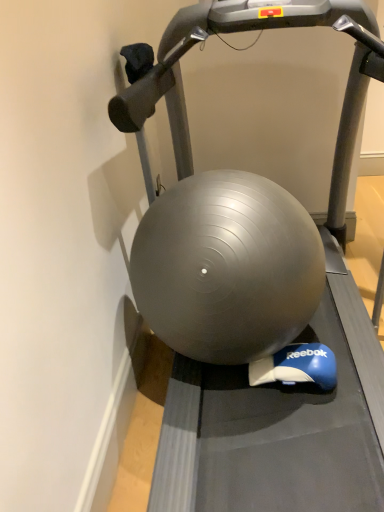
Where is `matte gray ball at center`? This screenshot has width=384, height=512. matte gray ball at center is located at coordinates (227, 267).

What do you see at coordinates (227, 267) in the screenshot? The width and height of the screenshot is (384, 512). I see `matte gray ball at center` at bounding box center [227, 267].

This screenshot has height=512, width=384. What do you see at coordinates (249, 303) in the screenshot?
I see `silver metallic treadmill at center` at bounding box center [249, 303].

At what (x,y) coordinates should I click in order to perform the action: click on silver metallic treadmill at center. Please return your answer as a coordinate pair (x, y). The height and width of the screenshot is (512, 384). Looking at the image, I should click on (249, 303).

Where is `matte gray ball at center`? The image size is (384, 512). matte gray ball at center is located at coordinates (227, 267).

Based on the photo, considering the relative positions of silver metallic treadmill at center and matte gray ball at center in the image provided, is silver metallic treadmill at center to the left of matte gray ball at center from the viewer's perspective?

No, silver metallic treadmill at center is not to the left of matte gray ball at center.

Between silver metallic treadmill at center and matte gray ball at center, which one is positioned in front?

silver metallic treadmill at center.

Is point (248, 360) positioned after point (303, 252)?

Yes, it is.

From the image's perspective, which one is positioned higher, silver metallic treadmill at center or matte gray ball at center?

silver metallic treadmill at center.

From a real-world perspective, who is located lower, silver metallic treadmill at center or matte gray ball at center?

matte gray ball at center is physically lower.

In the scene shown: Considering the sizes of silver metallic treadmill at center and matte gray ball at center in the image, is silver metallic treadmill at center wider or thinner than matte gray ball at center?

In the image, silver metallic treadmill at center appears to be wider than matte gray ball at center.

Considering the sizes of objects silver metallic treadmill at center and matte gray ball at center in the image provided, who is taller, silver metallic treadmill at center or matte gray ball at center?

silver metallic treadmill at center.

Is silver metallic treadmill at center smaller than matte gray ball at center?

Incorrect, silver metallic treadmill at center is not smaller in size than matte gray ball at center.

Is matte gray ball at center located within silver metallic treadmill at center?

Yes, matte gray ball at center is inside silver metallic treadmill at center.

Is silver metallic treadmill at center not close to matte gray ball at center?

No, silver metallic treadmill at center is not far from matte gray ball at center.

In the scene shown: Is silver metallic treadmill at center looking in the opposite direction of matte gray ball at center?

Yes, matte gray ball at center is at the back of silver metallic treadmill at center.

Consider the image. How many degrees apart are the facing directions of silver metallic treadmill at center and matte gray ball at center?

The angular difference between silver metallic treadmill at center and matte gray ball at center is 1.43 degrees.

You are a GUI agent. You are given a task and a screenshot of the screen. Output one action in this format:
    pyautogui.click(x=<x>, y=<y>)
    Task: Click on the treadmill in front of the matte gray ball at center
    The height and width of the screenshot is (512, 384).
    Given the screenshot: What is the action you would take?
    pyautogui.click(x=249, y=303)

Which is more to the left, matte gray ball at center or silver metallic treadmill at center?

From the viewer's perspective, matte gray ball at center appears more on the left side.

In the scene shown: In the image, is matte gray ball at center positioned in front of or behind silver metallic treadmill at center?

In the image, matte gray ball at center appears behind silver metallic treadmill at center.

Considering the points (255, 313) and (190, 184), which point is in front, point (255, 313) or point (190, 184)?

The point (255, 313) is closer to the camera.

From the image's perspective, is matte gray ball at center above or below silver metallic treadmill at center?

matte gray ball at center is below silver metallic treadmill at center.

From a real-world perspective, is matte gray ball at center on silver metallic treadmill at center?

No, from a real-world perspective, matte gray ball at center is not on top of silver metallic treadmill at center.

Considering the relative sizes of matte gray ball at center and silver metallic treadmill at center in the image provided, is matte gray ball at center wider than silver metallic treadmill at center?

Incorrect, the width of matte gray ball at center does not surpass that of silver metallic treadmill at center.

Does matte gray ball at center have a lesser height compared to silver metallic treadmill at center?

Indeed, matte gray ball at center has a lesser height compared to silver metallic treadmill at center.

Who is bigger, matte gray ball at center or silver metallic treadmill at center?

With larger size is silver metallic treadmill at center.

Is silver metallic treadmill at center located within matte gray ball at center?

No, silver metallic treadmill at center is not inside matte gray ball at center.

Is matte gray ball at center with silver metallic treadmill at center?

Yes.

Is matte gray ball at center aimed at silver metallic treadmill at center?

Yes, matte gray ball at center is oriented towards silver metallic treadmill at center.

Can you tell me how much matte gray ball at center and silver metallic treadmill at center differ in facing direction?

The facing directions of matte gray ball at center and silver metallic treadmill at center are 1.43 degrees apart.

You are a GUI agent. You are given a task and a screenshot of the screen. Output one action in this format:
    pyautogui.click(x=<x>, y=<y>)
    Task: Click on the ball lying behind the silver metallic treadmill at center
    The image size is (384, 512).
    Given the screenshot: What is the action you would take?
    pyautogui.click(x=227, y=267)

What are the coordinates of `treadmill on the right of matte gray ball at center` in the screenshot? It's located at (249, 303).

You are a GUI agent. You are given a task and a screenshot of the screen. Output one action in this format:
    pyautogui.click(x=<x>, y=<y>)
    Task: Click on the treadmill located in front of the matte gray ball at center
    
    Given the screenshot: What is the action you would take?
    pyautogui.click(x=249, y=303)